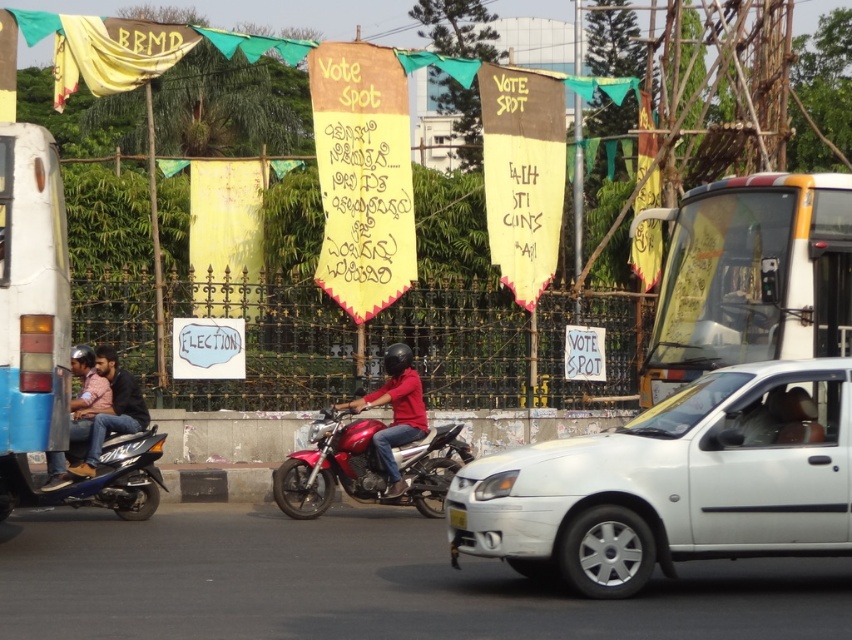
Question: Which point is farther from the camera taking this photo?

Choices:
 (A) (796, 392)
 (B) (112, 499)
 (C) (728, 349)
 (D) (450, 508)

Answer: (B)

Question: Which of the following is the farthest from the observer?

Choices:
 (A) matte red motorcycle at center
 (B) white matte bus at left

Answer: (A)

Question: Can you confirm if matte red motorcycle at center is bigger than matte blue jeans at left?

Choices:
 (A) yes
 (B) no

Answer: (A)

Question: Can you confirm if matte red motorcycle at center is positioned to the left of matte blue jeans at left?

Choices:
 (A) no
 (B) yes

Answer: (A)

Question: Which point is closer to the camera?

Choices:
 (A) white glossy bus at upper right
 (B) white matte car at center
 (C) blue glossy scooter at left
 (D) matte black motorcycle at left

Answer: (B)

Question: Is white matte bus at left positioned before matte black motorcycle at left?

Choices:
 (A) yes
 (B) no

Answer: (A)